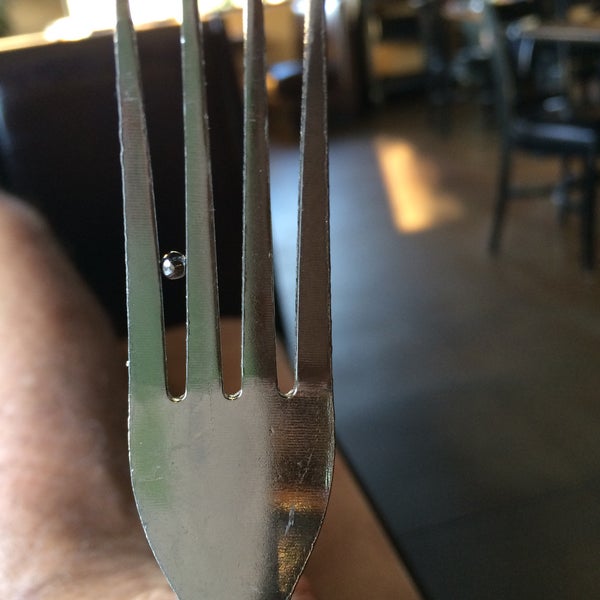
The image size is (600, 600). I want to click on back left chair leg, so click(x=572, y=172).